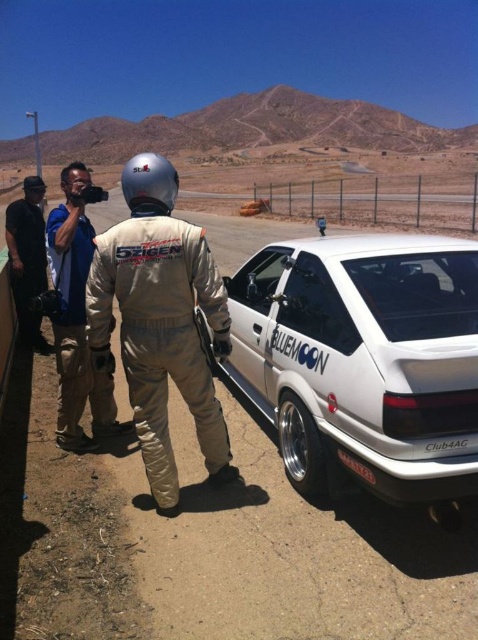
Between blue denim jacket at center and black plastic license plate at lower center, which one has more height?

Standing taller between the two is blue denim jacket at center.

Does blue denim jacket at center come behind black plastic license plate at lower center?

Yes, blue denim jacket at center is behind black plastic license plate at lower center.

Describe the element at coordinates (76, 317) in the screenshot. I see `blue denim jacket at center` at that location.

Where is `blue denim jacket at center`? blue denim jacket at center is located at coordinates (76, 317).

Is tan fabric suit at center smaller than blue denim jacket at center?

Indeed, tan fabric suit at center has a smaller size compared to blue denim jacket at center.

Is tan fabric suit at center shorter than blue denim jacket at center?

Yes, tan fabric suit at center is shorter than blue denim jacket at center.

This screenshot has height=640, width=478. What do you see at coordinates (161, 321) in the screenshot?
I see `tan fabric suit at center` at bounding box center [161, 321].

Identify the location of tan fabric suit at center. This screenshot has height=640, width=478. (161, 321).

Can you confirm if white glossy hatchback at center is positioned to the left of tan fabric suit at center?

Incorrect, white glossy hatchback at center is not on the left side of tan fabric suit at center.

Can you confirm if white glossy hatchback at center is shorter than tan fabric suit at center?

Indeed, white glossy hatchback at center has a lesser height compared to tan fabric suit at center.

Image resolution: width=478 pixels, height=640 pixels. What are the coordinates of `white glossy hatchback at center` in the screenshot? It's located at (364, 358).